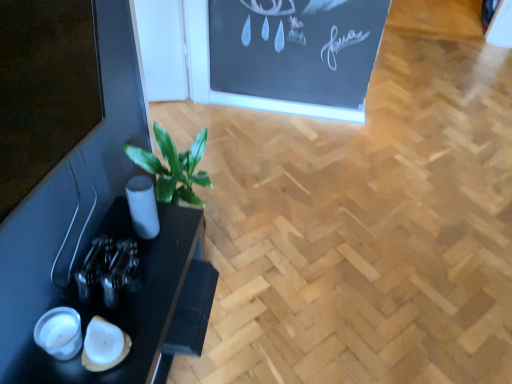
Question: Is black glossy table at lower left wider or thinner than metallic glass bottle at left?

Choices:
 (A) thin
 (B) wide

Answer: (B)

Question: Is black glossy table at lower left inside the boundaries of metallic glass bottle at left, or outside?

Choices:
 (A) inside
 (B) outside

Answer: (B)

Question: Is black glossy table at lower left to the left or to the right of metallic glass bottle at left in the image?

Choices:
 (A) left
 (B) right

Answer: (A)

Question: From a real-world perspective, relative to black glossy table at lower left, is metallic glass bottle at left vertically above or below?

Choices:
 (A) above
 (B) below

Answer: (A)

Question: Is point (129, 271) positioned closer to the camera than point (167, 274)?

Choices:
 (A) closer
 (B) farther

Answer: (A)

Question: Relative to black glossy table at lower left, is metallic glass bottle at left in front or behind?

Choices:
 (A) front
 (B) behind

Answer: (B)

Question: Is metallic glass bottle at left wider or thinner than black glossy table at lower left?

Choices:
 (A) wide
 (B) thin

Answer: (B)